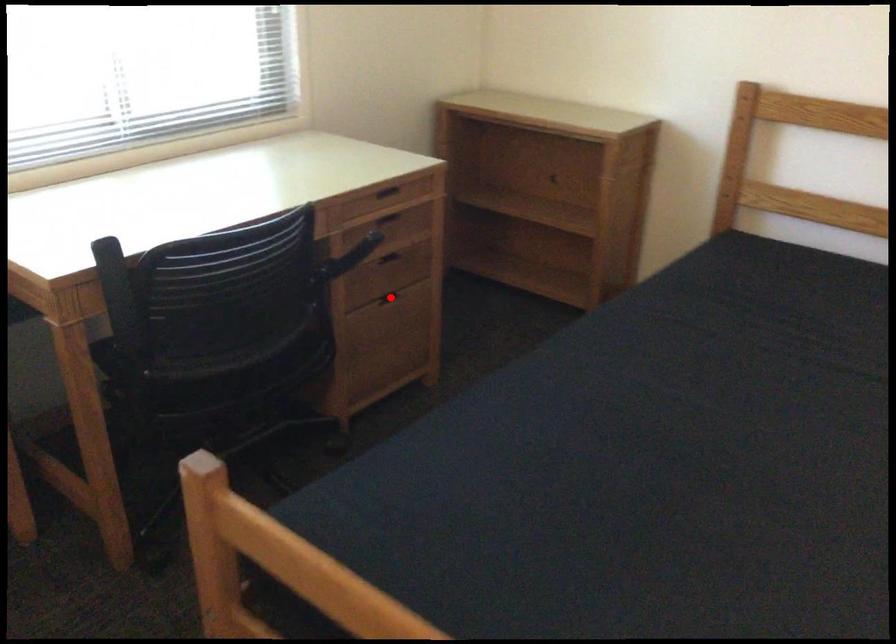
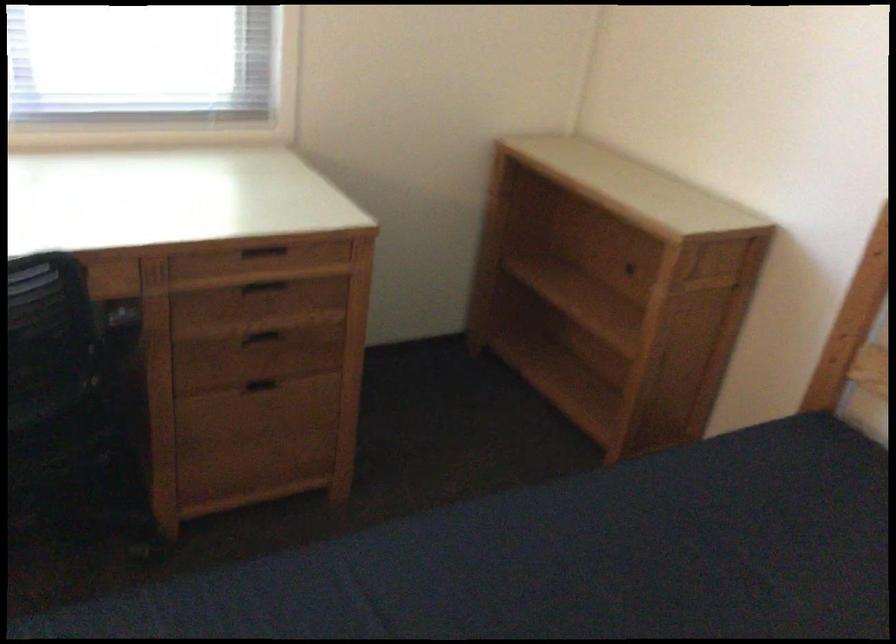
In the second image, find the point that corresponds to the highlighted location in the first image.

(261, 384)